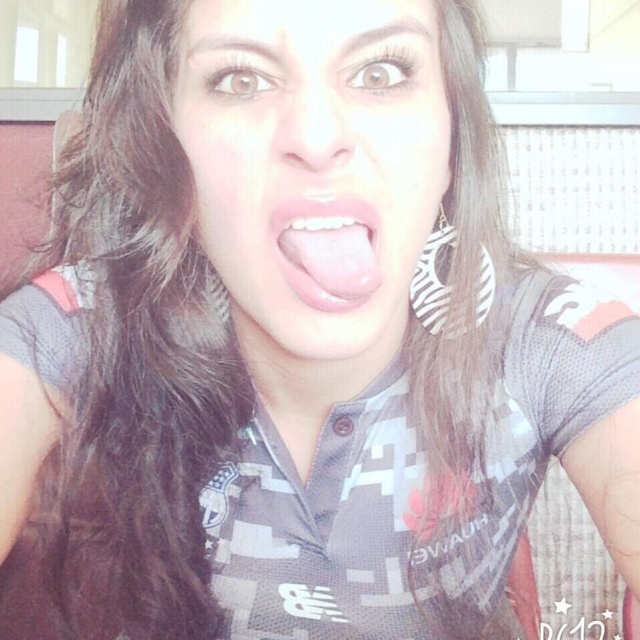
You are taking a photo of two points in the scene. The first point is at coordinate point [445,144] and the second point is at point [326,285]. Which point is closer to the camera?

Point [445,144] is further to the camera than point [326,285], so the closer point to the camera is point [326,285].

You are a photographer adjusting the focus of your camera. The camera can only focus on objects within a 1.5 inch range. You need to capture both the matte skin face at center and the pink glossy tongue at center in sharp focus. Is this possible?

The matte skin face at center is 1.85 inches away from the pink glossy tongue at center. Since the camera can only focus on objects within a 1.5 inch range, the distance between them exceeds the focus range. Therefore, it is not possible to have both in sharp focus.